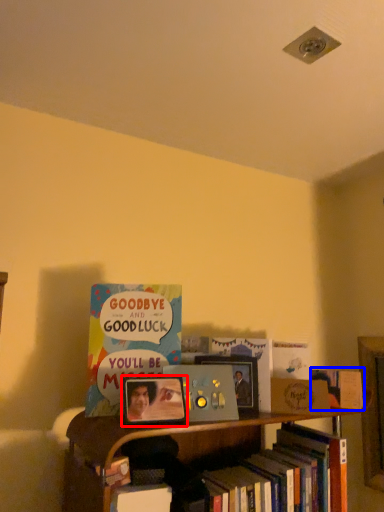
Question: Among these objects, which one is farthest to the camera, picture frame (highlighted by a red box) or book (highlighted by a blue box)?

Choices:
 (A) picture frame
 (B) book

Answer: (B)